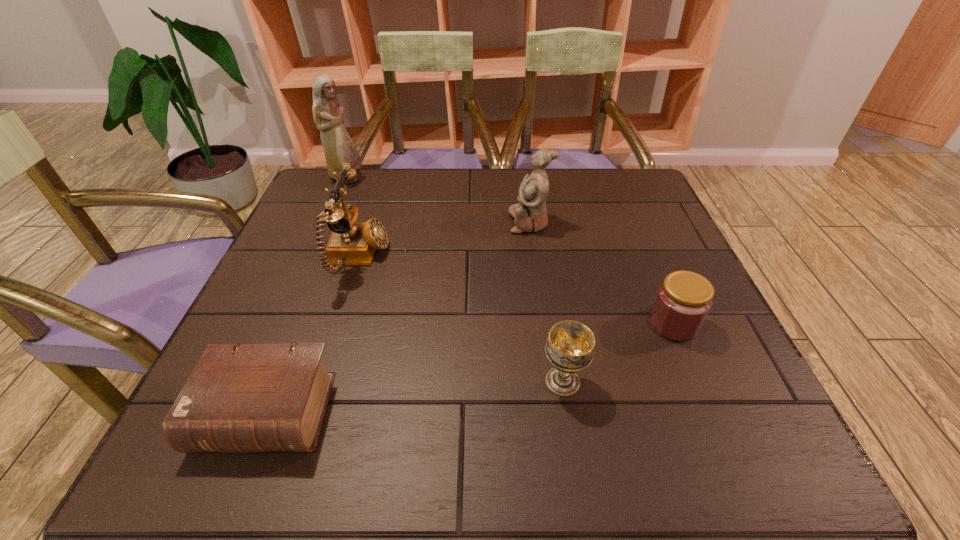
Where is `object that is positioned at the right edge`? Image resolution: width=960 pixels, height=540 pixels. object that is positioned at the right edge is located at coordinates click(683, 300).

Identify the location of object located in the far left corner section of the desktop. This screenshot has width=960, height=540. (339, 148).

What are the coordinates of `object located in the near left corner section of the desktop` in the screenshot? It's located at (240, 398).

Locate an element on the screen. free spot at the far edge of the desktop is located at coordinates (388, 212).

What are the coordinates of `vacant region at the near edge of the desktop` in the screenshot? It's located at (525, 450).

The height and width of the screenshot is (540, 960). In the image, there is a desktop. Identify the location of vacant space at the left edge. (311, 322).

Where is `vacant space at the right edge of the desktop`? The width and height of the screenshot is (960, 540). vacant space at the right edge of the desktop is located at coordinates (684, 263).

The height and width of the screenshot is (540, 960). What are the coordinates of `vacant area at the far left corner` in the screenshot? It's located at (301, 214).

In the image, there is a desktop. At what (x,y) coordinates should I click in order to perform the action: click on vacant area at the near right corner. Please return your answer as a coordinate pair (x, y). Image resolution: width=960 pixels, height=540 pixels. Looking at the image, I should click on (691, 453).

This screenshot has height=540, width=960. In order to click on free space between the chalice and the jam in this screenshot , I will do tap(617, 353).